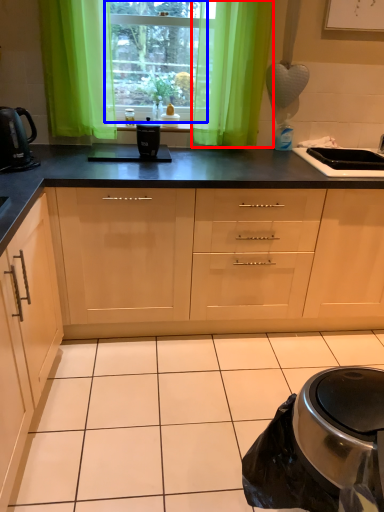
Question: Which object appears farthest to the camera in this image, curtain (highlighted by a red box) or window (highlighted by a blue box)?

Choices:
 (A) curtain
 (B) window

Answer: (B)